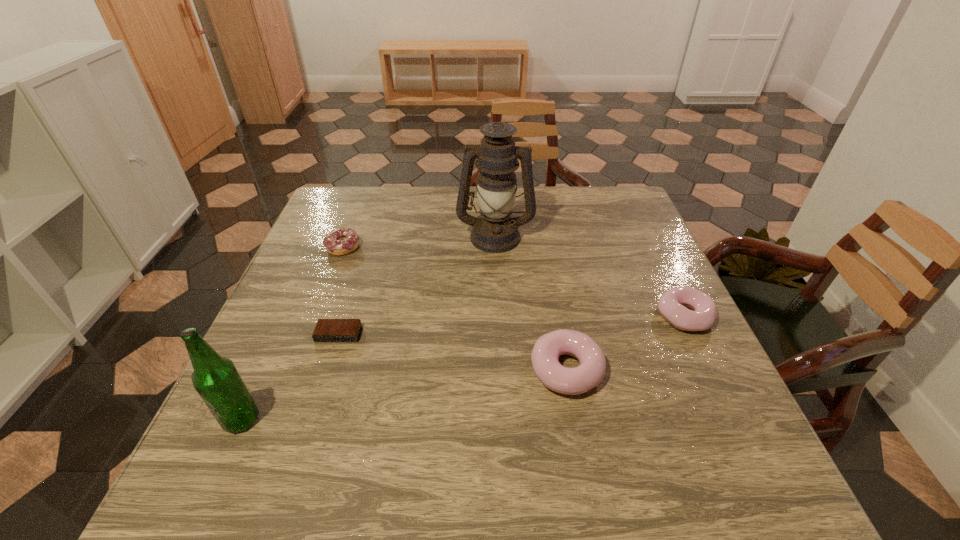
The height and width of the screenshot is (540, 960). I want to click on free space that is in between the nearest object and the rightmost object, so click(463, 368).

Locate an element on the screen. Image resolution: width=960 pixels, height=540 pixels. free space between the second doughnut from left to right and the shortest object is located at coordinates (452, 352).

Where is `vacant space that is in between the second nearest doughnut and the oil lamp`? vacant space that is in between the second nearest doughnut and the oil lamp is located at coordinates (589, 276).

At what (x,y) coordinates should I click in order to perform the action: click on free point between the second tallest object and the tallest object. Please return your answer as a coordinate pair (x, y). Looking at the image, I should click on (369, 328).

Find the location of a particular element. Image resolution: width=960 pixels, height=540 pixels. empty location between the oil lamp and the shortest doughnut is located at coordinates (420, 241).

Locate an element on the screen. This screenshot has width=960, height=540. unoccupied position between the shortest object and the second nearest doughnut is located at coordinates (511, 325).

Find the location of `vacant space that is in between the alarm clock and the tallest object`. vacant space that is in between the alarm clock and the tallest object is located at coordinates (417, 285).

Find the location of `free space between the fifth tallest object and the rightmost object`. free space between the fifth tallest object and the rightmost object is located at coordinates (514, 282).

The width and height of the screenshot is (960, 540). Find the location of `vacant space that's between the shortest object and the beer bottle`. vacant space that's between the shortest object and the beer bottle is located at coordinates (290, 377).

Locate an element on the screen. free space that is in between the alarm clock and the fifth tallest object is located at coordinates (341, 291).